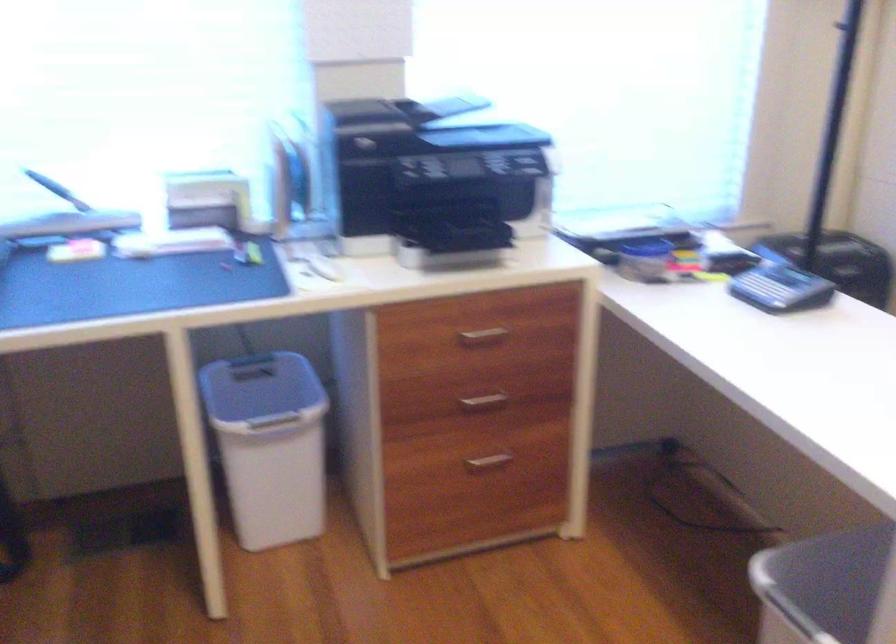
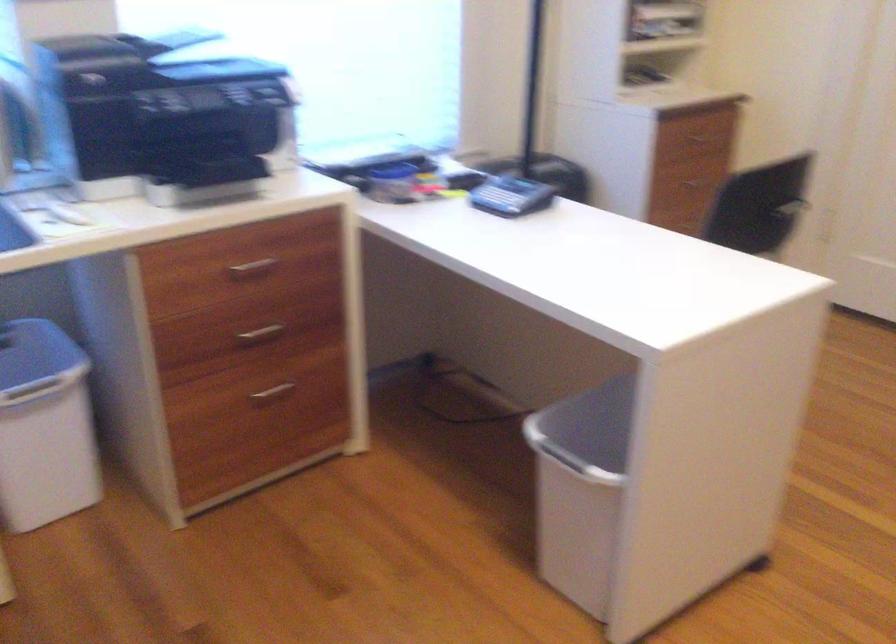
Question: Which direction would the cameraman need to move to produce the second image? Reply with the corresponding letter.

Choices:
 (A) Left
 (B) Right
 (C) Forward
 (D) Backward

Answer: (A)